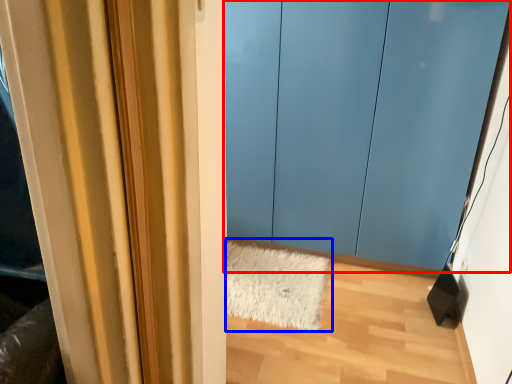
Question: Which point is further to the camera, door (highlighted by a red box) or doormat (highlighted by a blue box)?

Choices:
 (A) door
 (B) doormat

Answer: (B)